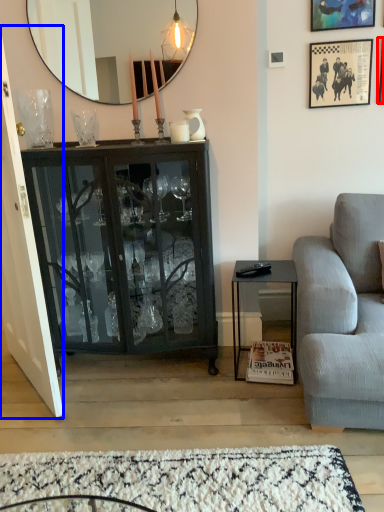
Question: Which object is closer to the camera taking this photo, picture frame (highlighted by a red box) or door (highlighted by a blue box)?

Choices:
 (A) picture frame
 (B) door

Answer: (B)